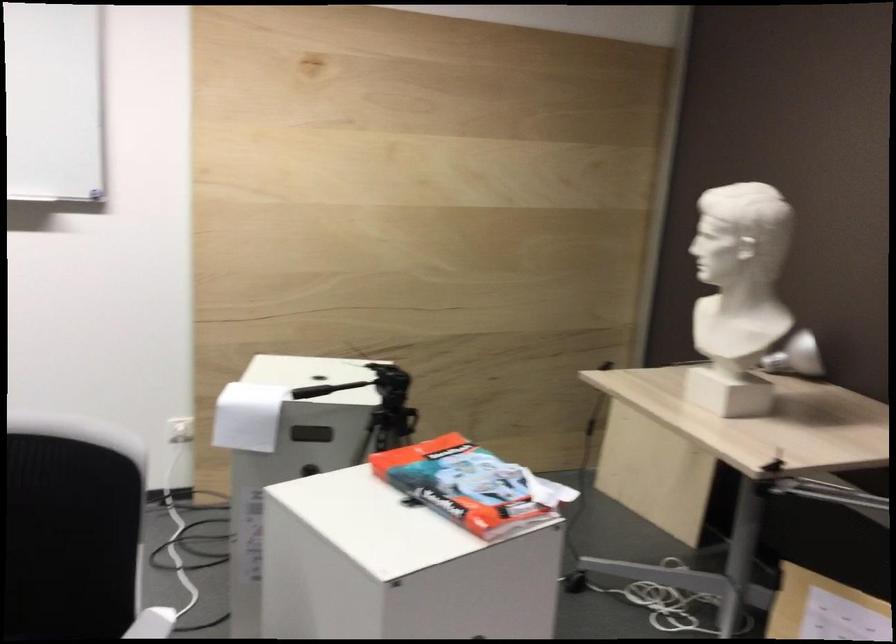
The location [746,281] corresponds to which object?

It corresponds to the white sculpture bust in the image.